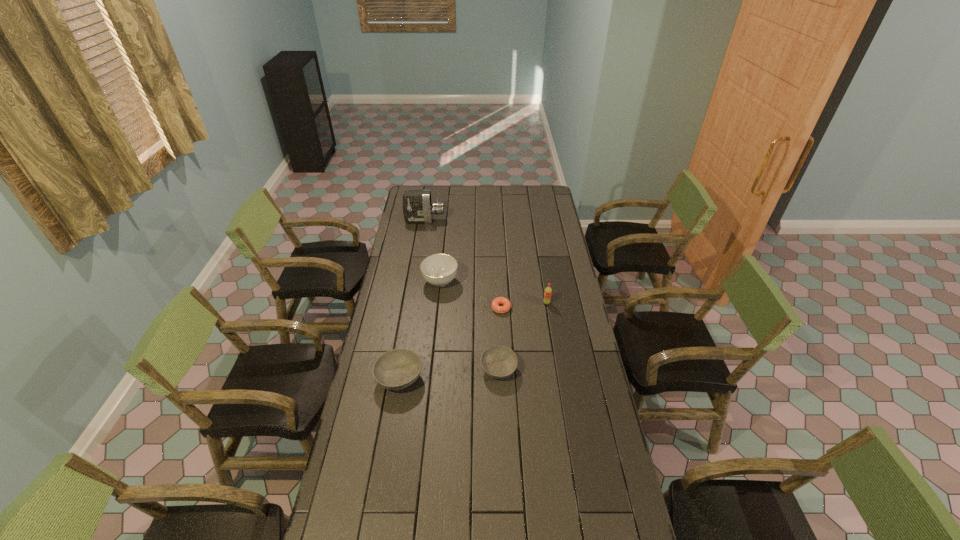
The image size is (960, 540). I want to click on vacant space situated 0.260m on the right of the third shortest object, so click(x=490, y=378).

Locate an element on the screen. This screenshot has width=960, height=540. vacant position located 0.330m on the back of the right bowl is located at coordinates (496, 299).

Identify the location of vacant space located on the back of the chinaware. This screenshot has width=960, height=540. (445, 231).

Find the location of a particular element. This screenshot has height=540, width=960. vacant space situated 0.380m at the front of the camcorder, highlighting the lens is located at coordinates (510, 221).

Where is `vacant space situated on the right of the doughnut`? The width and height of the screenshot is (960, 540). vacant space situated on the right of the doughnut is located at coordinates (564, 308).

Identify the location of vacant region located 0.400m on the left of the soda. The height and width of the screenshot is (540, 960). (457, 303).

I want to click on bowl that is positioned at the left edge, so click(x=396, y=369).

Find the location of a particular element. camcorder present at the left edge is located at coordinates (417, 207).

In order to click on object that is at the right edge in this screenshot , I will do `click(548, 291)`.

Where is `vacant space at the left edge of the desktop`? The image size is (960, 540). vacant space at the left edge of the desktop is located at coordinates (412, 282).